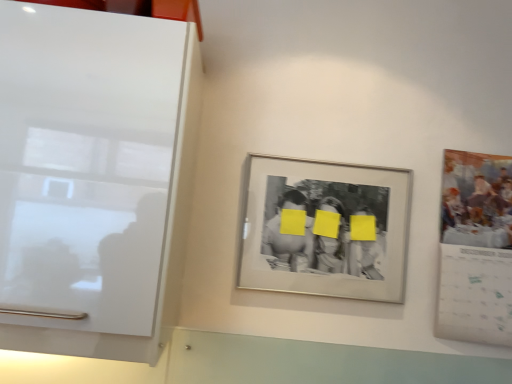
Question: Is white glossy cabinet at left thinner than silver/metallic photo frame at center?

Choices:
 (A) no
 (B) yes

Answer: (A)

Question: Is white glossy cabinet at left taller than silver/metallic photo frame at center?

Choices:
 (A) no
 (B) yes

Answer: (B)

Question: From a real-world perspective, is white glossy cabinet at left under silver/metallic photo frame at center?

Choices:
 (A) yes
 (B) no

Answer: (B)

Question: Would you say white glossy cabinet at left is outside silver/metallic photo frame at center?

Choices:
 (A) yes
 (B) no

Answer: (A)

Question: Is white glossy cabinet at left facing away from silver/metallic photo frame at center?

Choices:
 (A) no
 (B) yes

Answer: (A)

Question: Can you confirm if white glossy cabinet at left is positioned to the right of silver/metallic photo frame at center?

Choices:
 (A) no
 (B) yes

Answer: (A)

Question: Can you confirm if silver/metallic photo frame at center is smaller than white glossy cabinet at left?

Choices:
 (A) no
 (B) yes

Answer: (B)

Question: From the image's perspective, would you say silver/metallic photo frame at center is shown under white glossy cabinet at left?

Choices:
 (A) yes
 (B) no

Answer: (A)

Question: Does silver/metallic photo frame at center have a greater width compared to white glossy cabinet at left?

Choices:
 (A) yes
 (B) no

Answer: (B)

Question: Does silver/metallic photo frame at center have a lesser height compared to white glossy cabinet at left?

Choices:
 (A) no
 (B) yes

Answer: (B)

Question: Is silver/metallic photo frame at center thinner than white glossy cabinet at left?

Choices:
 (A) no
 (B) yes

Answer: (B)

Question: From a real-world perspective, is silver/metallic photo frame at center on top of white glossy cabinet at left?

Choices:
 (A) yes
 (B) no

Answer: (B)

Question: Looking at their shapes, would you say white glossy cabinet at left is wider or thinner than silver/metallic photo frame at center?

Choices:
 (A) thin
 (B) wide

Answer: (B)